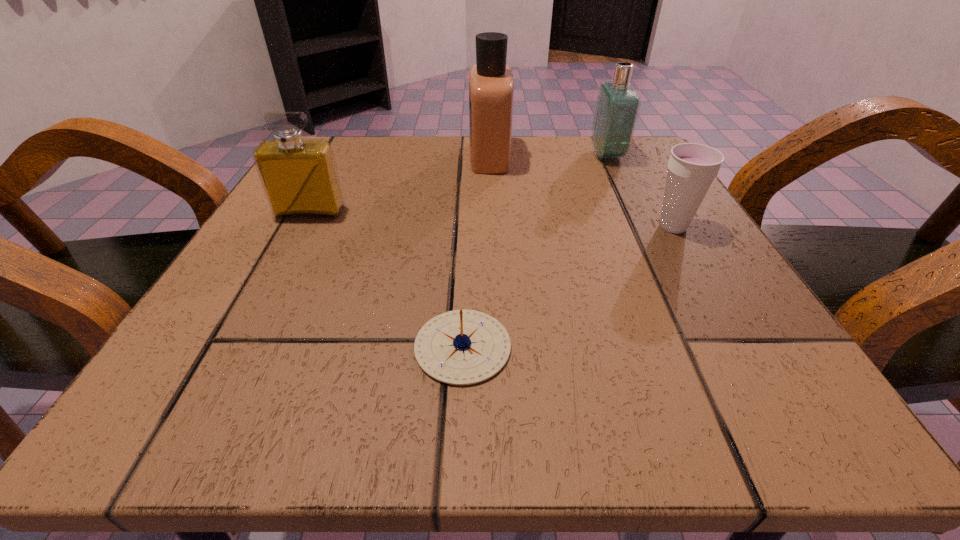
Select which object is the second closest to the rightmost perfume. Please provide its 2D coordinates. Your answer should be formatted as a tuple, i.e. [(x, y)], where the tuple contains the x and y coordinates of a point satisfying the conditions above.

[(692, 167)]

The height and width of the screenshot is (540, 960). I want to click on perfume object that ranks as the closest to the nearest object, so click(300, 179).

Point out which perfume is positioned as the second nearest to the tallest perfume. Please provide its 2D coordinates. Your answer should be formatted as a tuple, i.e. [(x, y)], where the tuple contains the x and y coordinates of a point satisfying the conditions above.

[(300, 179)]

Where is `vacant space that satisfies the following two spatial constraints: 1. on the front label of the second perfume from left to right; 2. on the back side of the cup`? The width and height of the screenshot is (960, 540). vacant space that satisfies the following two spatial constraints: 1. on the front label of the second perfume from left to right; 2. on the back side of the cup is located at coordinates (492, 227).

Locate an element on the screen. This screenshot has height=540, width=960. vacant space that satisfies the following two spatial constraints: 1. on the front label of the rightmost perfume; 2. on the back side of the fourth tallest object is located at coordinates (641, 227).

Where is `vacant space that satisfies the following two spatial constraints: 1. on the front-facing side of the fourth tallest object; 2. on the left side of the leftmost perfume`? The image size is (960, 540). vacant space that satisfies the following two spatial constraints: 1. on the front-facing side of the fourth tallest object; 2. on the left side of the leftmost perfume is located at coordinates (302, 227).

This screenshot has height=540, width=960. In order to click on vacant area in the image that satisfies the following two spatial constraints: 1. on the front label of the cup; 2. on the left side of the rightmost perfume in this screenshot , I will do `click(641, 227)`.

Find the location of a particular element. This screenshot has width=960, height=540. vacant region that satisfies the following two spatial constraints: 1. on the front-facing side of the cup; 2. on the left side of the leftmost perfume is located at coordinates (302, 227).

Where is `vacant space that satisfies the following two spatial constraints: 1. on the front label of the second shortest object; 2. on the right side of the rightmost perfume`? The height and width of the screenshot is (540, 960). vacant space that satisfies the following two spatial constraints: 1. on the front label of the second shortest object; 2. on the right side of the rightmost perfume is located at coordinates (641, 227).